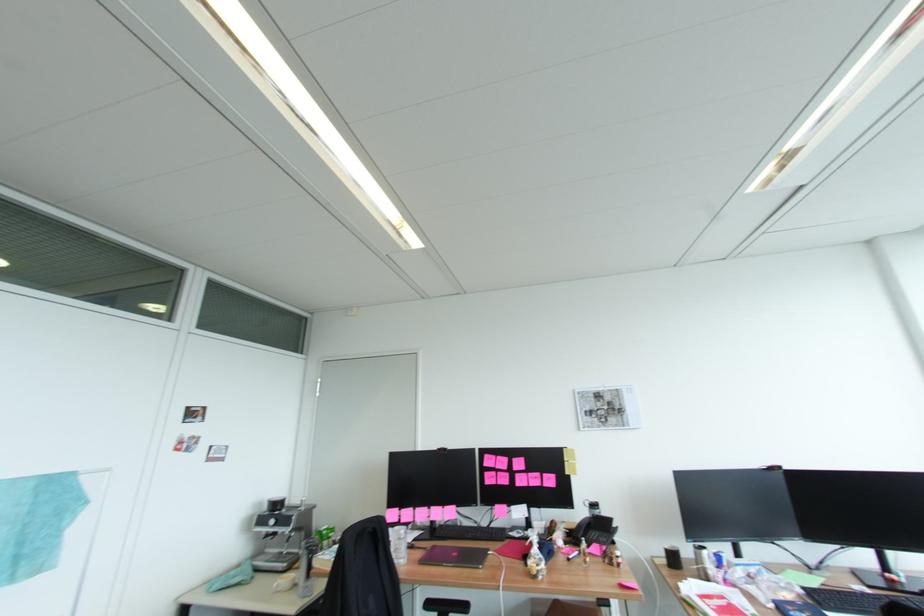
I want to click on water glass, so pos(397,543).